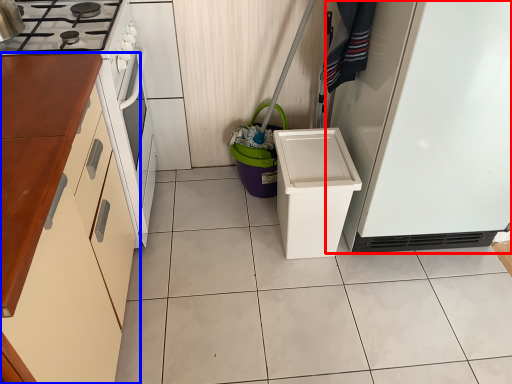
Question: Which object is closer to the camera taking this photo, refrigerator (highlighted by a red box) or cabinetry (highlighted by a blue box)?

Choices:
 (A) refrigerator
 (B) cabinetry

Answer: (B)